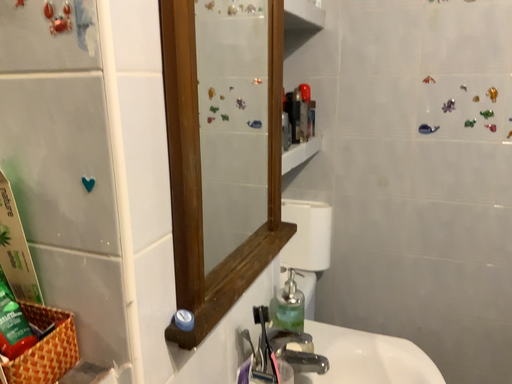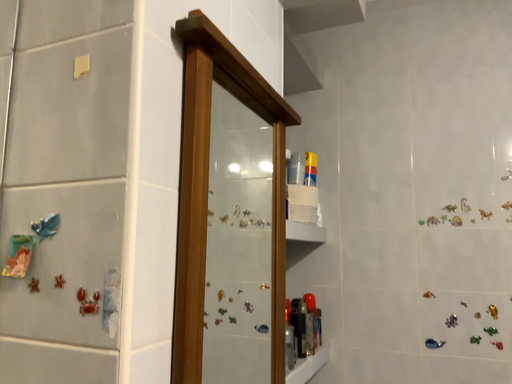
Question: How did the camera likely rotate when shooting the video?

Choices:
 (A) rotated upward
 (B) rotated downward

Answer: (A)